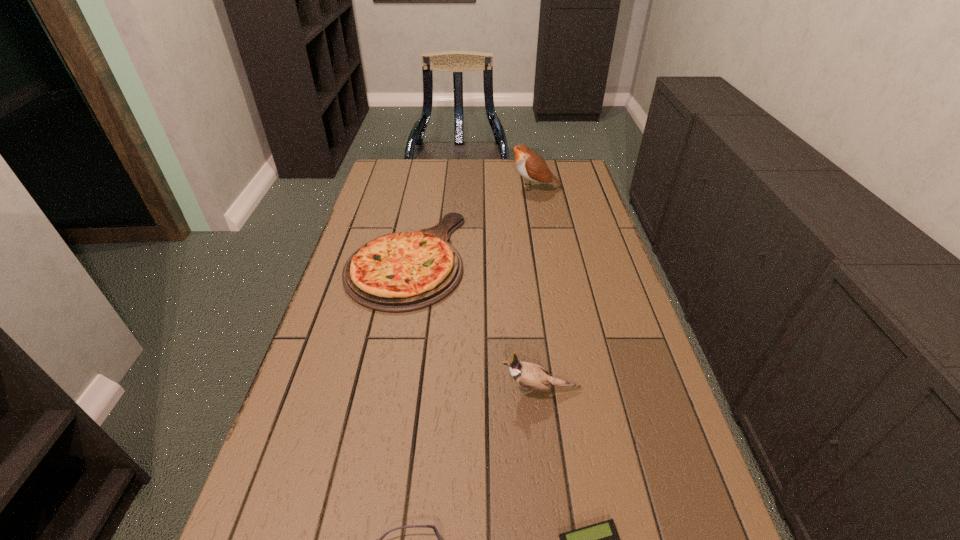
Identify the location of the tallest object. (531, 166).

I want to click on the farther bird, so click(531, 166).

In order to click on the shorter bird in this screenshot , I will do `click(529, 375)`.

Where is `the nearer bird`? The image size is (960, 540). the nearer bird is located at coordinates (529, 375).

The image size is (960, 540). I want to click on the third tallest object, so click(399, 272).

Find the location of a particular element. This screenshot has width=960, height=540. pizza is located at coordinates (399, 272).

The image size is (960, 540). Find the location of `vacant position located at the face of the farthest object`. vacant position located at the face of the farthest object is located at coordinates (473, 187).

This screenshot has height=540, width=960. Identify the location of free location located at the face of the farthest object. [x=478, y=187].

This screenshot has width=960, height=540. I want to click on free spot located 0.270m at the face of the farthest object, so click(435, 187).

What are the coordinates of `vacant position located 0.160m at the face of the third farthest object` in the screenshot? It's located at coord(426,389).